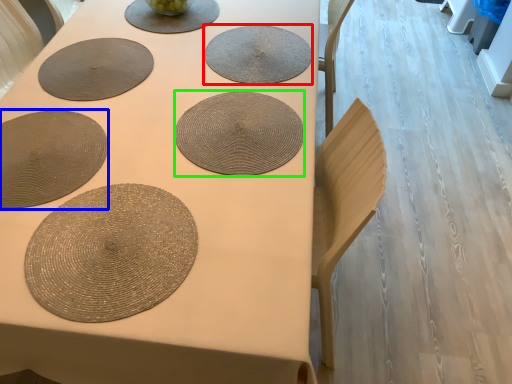
Question: Which object is the closest to the coaster (highlighted by a red box)? Choose among these: paper plate (highlighted by a blue box) or coaster (highlighted by a green box).

Choices:
 (A) paper plate
 (B) coaster

Answer: (B)